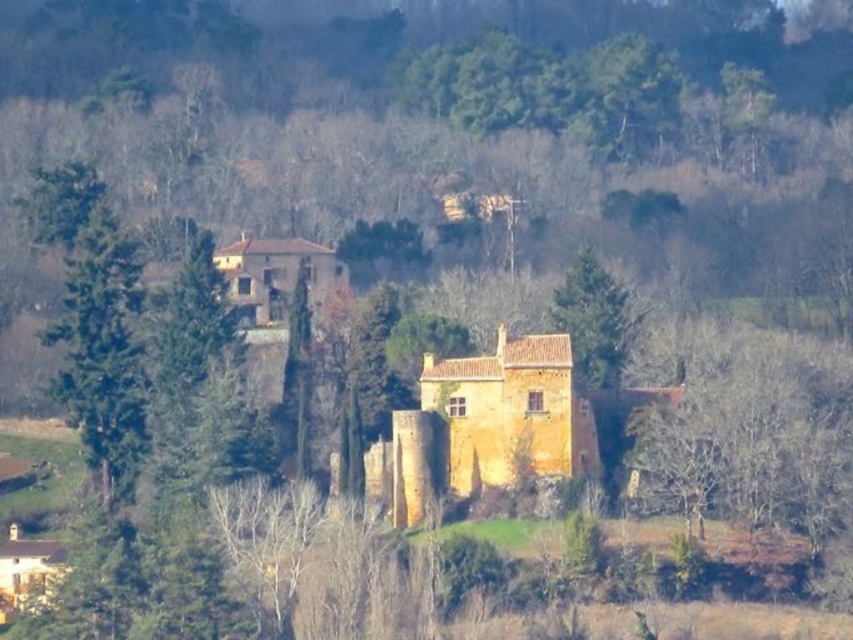
You are standing in the rural landscape scene and want to determine the relative positions of two points. Which point, point (393, 508) or point (114, 422), is closer to you?

Point (393, 508) is closer to the viewer than point (114, 422).

You are standing in the rural landscape and want to take a photo of the yellow stone castle at center and the green rough bark tree at left. Which object should you position to your left side in the camera frame?

The green rough bark tree at left should be positioned to your left side in the camera frame because the yellow stone castle at center is to the right of the green rough bark tree at left.

You are an architect visiting this rural landscape. You need to determine which structure is larger between the yellow stone castle at center and the green rough bark tree at left. Based on the scene, which one is bigger?

The yellow stone castle at center is smaller than the green rough bark tree at left, so the green rough bark tree at left is larger.